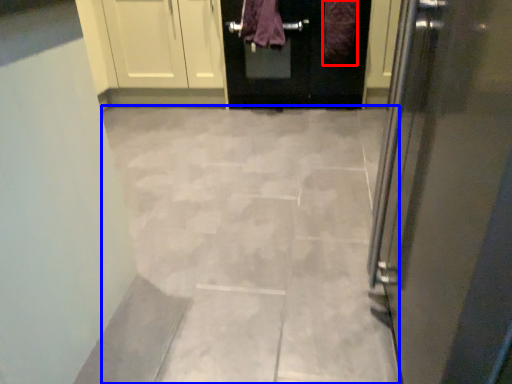
Question: Among these objects, which one is nearest to the camera, blanket (highlighted by a red box) or ceramic tile (highlighted by a blue box)?

Choices:
 (A) blanket
 (B) ceramic tile

Answer: (B)